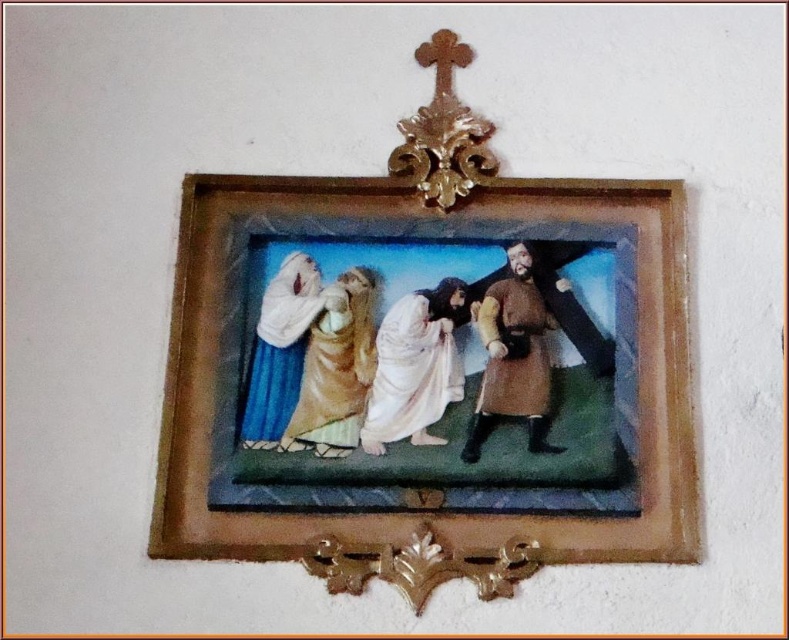
Question: Which object is closer to the camera taking this photo?

Choices:
 (A) brown leather coat at center
 (B) wooden frame at center
 (C) white cloth at center

Answer: (B)

Question: Which is farther from the brown leather coat at center?

Choices:
 (A) white cloth at center
 (B) gold ornate crucifix at upper center
 (C) matte gold robe at center

Answer: (A)

Question: Does wooden frame at center appear over matte gold robe at center?

Choices:
 (A) yes
 (B) no

Answer: (B)

Question: Which point appears farthest from the camera in this image?

Choices:
 (A) (268, 356)
 (B) (419, 312)
 (C) (335, 333)
 (D) (410, 225)

Answer: (D)

Question: Where is wooden frame at center located in relation to white cloth at center in the image?

Choices:
 (A) right
 (B) left

Answer: (A)

Question: From the image, what is the correct spatial relationship of white clothed figure at center in relation to brown leather coat at center?

Choices:
 (A) above
 (B) below

Answer: (B)